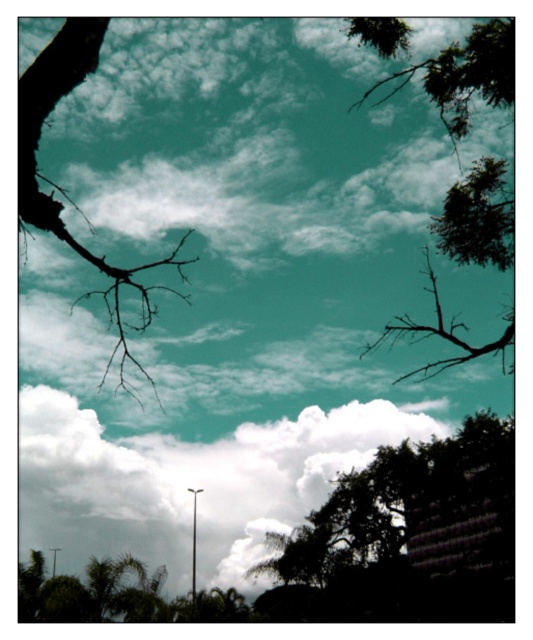
You are standing in a park and want to take a photo of the green leafy tree at upper right and the black matte branch at left. Which object should you focus on first to ensure both are in focus?

You should focus on the black matte branch at left first because it is closer to you than the green leafy tree at upper right, so adjusting focus from near to far will help both be in focus.

You are standing in a field looking up at the sky. You see a white fluffy cloud at center. If you want to take a photo of it with your smartphone camera, will you need to zoom in or out to frame the cloud properly?

The white fluffy cloud at center is 29.56 meters away from the camera. Since smartphones typically have a standard focal length of around 28mm to 50mm, which can capture objects at that distance without needing significant zoom adjustment, you can likely frame the cloud properly without zooming in or out. However, slight adjustments might be needed based on your phone model and desired composition.

You are standing in front of a large window that shows the vibrant sky scene described. You notice a specific point marked at coordinates (188, 483). What object is located at that point?

At point (188, 483) lies a white fluffy cloud at center.